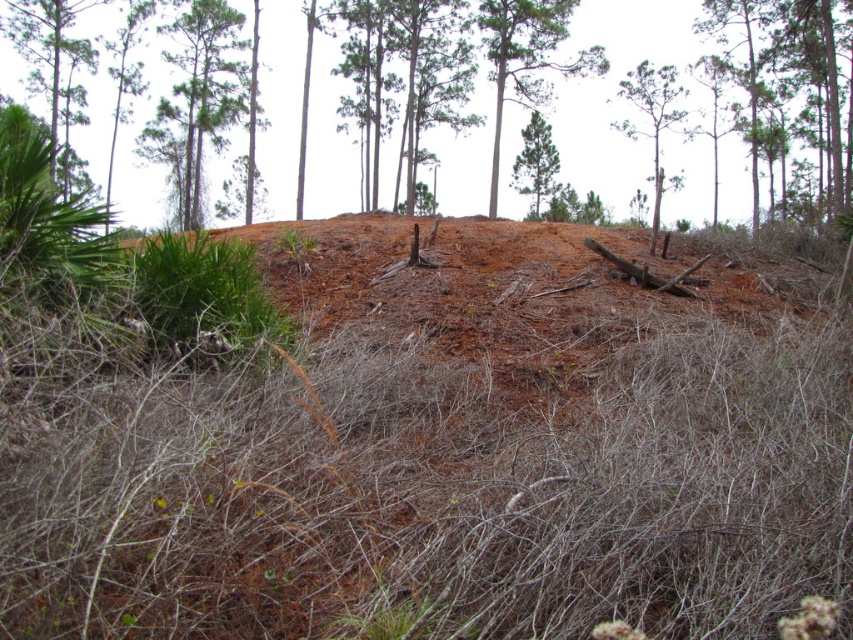
Can you confirm if green leafy tree at upper left is shorter than green leafy tree at upper center?

Yes.

At what (x,y) coordinates should I click in order to perform the action: click on green leafy tree at upper left. Please return your answer as a coordinate pair (x, y). The height and width of the screenshot is (640, 853). Looking at the image, I should click on (196, 97).

Does point (242, 96) lie behind point (659, 170)?

Yes, it is.

The image size is (853, 640). I want to click on green leafy tree at upper left, so click(x=196, y=97).

Is green leafy tree at upper left smaller than green matte tree at upper center?

Yes.

Does point (178, 138) come farther from viewer compared to point (547, 28)?

That is True.

I want to click on green leafy tree at upper left, so click(x=196, y=97).

Locate an element on the screen. The height and width of the screenshot is (640, 853). green leafy tree at upper left is located at coordinates (196, 97).

Is green matte tree at upper center taller than green leafy tree at upper center?

No.

This screenshot has width=853, height=640. Describe the element at coordinates (527, 58) in the screenshot. I see `green matte tree at upper center` at that location.

Is point (525, 106) closer to camera compared to point (663, 120)?

Yes, point (525, 106) is closer to viewer.

This screenshot has width=853, height=640. Find the location of `green matte tree at upper center`. green matte tree at upper center is located at coordinates (527, 58).